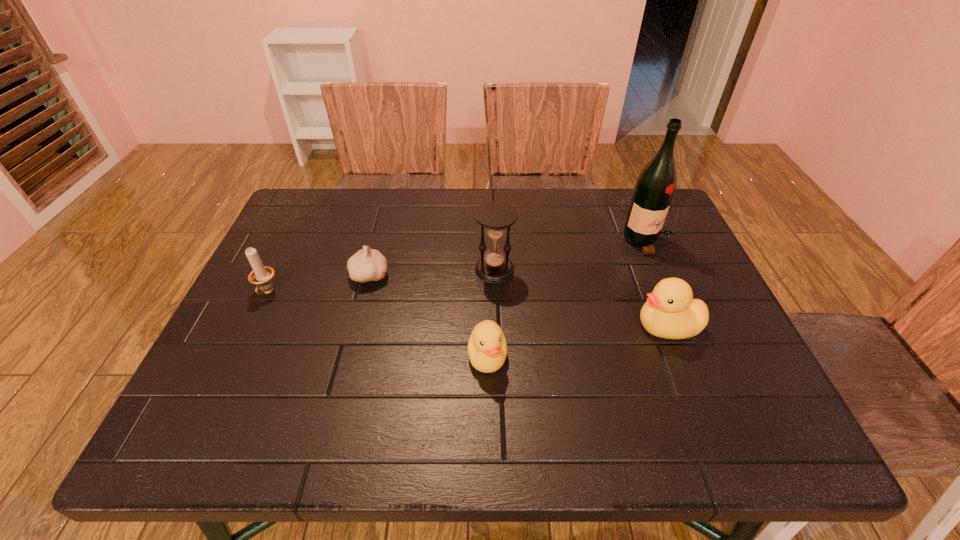
In order to click on blank area located 0.260m at the beak of the taller duck in this screenshot , I will do `click(520, 326)`.

Where is `vacant space located on the left of the tallest object`? vacant space located on the left of the tallest object is located at coordinates (523, 242).

What are the coordinates of `vacant space located 0.110m on the front of the shortest object` in the screenshot? It's located at (357, 323).

The height and width of the screenshot is (540, 960). Find the location of `vacant space located on the handle side of the candle_holder`. vacant space located on the handle side of the candle_holder is located at coordinates 239,352.

In order to click on free spot located on the left of the second tallest object in this screenshot , I will do `click(394, 269)`.

Image resolution: width=960 pixels, height=540 pixels. In order to click on object at the far edge in this screenshot , I will do `click(656, 184)`.

The image size is (960, 540). Identify the location of object present at the near edge. (487, 349).

You are a GUI agent. You are given a task and a screenshot of the screen. Output one action in this format:
    pyautogui.click(x=<x>, y=<y>)
    Task: Click on the object situated at the left edge
    The image size is (960, 540).
    Given the screenshot: What is the action you would take?
    pyautogui.click(x=262, y=276)

This screenshot has height=540, width=960. Identify the location of duck positioned at the right edge. (670, 312).

Where is `wine bottle that is at the right edge`? wine bottle that is at the right edge is located at coordinates 656,184.